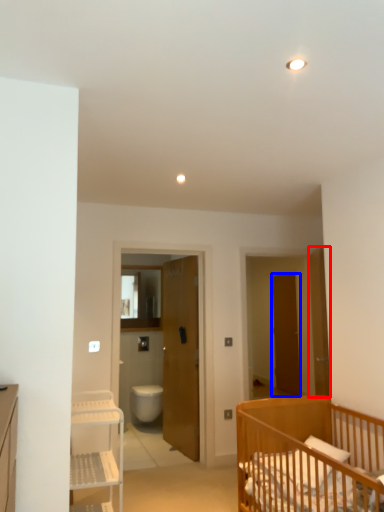
Question: Which of the following is the closest to the observer, door (highlighted by a red box) or door (highlighted by a blue box)?

Choices:
 (A) door
 (B) door

Answer: (A)